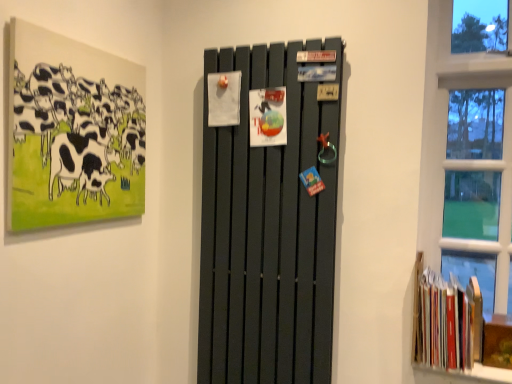
Question: From a real-world perspective, relative to matte black radiator at center, is hardcover books at lower right vertically above or below?

Choices:
 (A) below
 (B) above

Answer: (A)

Question: Is hardcover books at lower right taller or shorter than matte black radiator at center?

Choices:
 (A) short
 (B) tall

Answer: (A)

Question: Estimate the real-world distances between objects in this image. Which object is closer to the hardcover books at lower right?

Choices:
 (A) matte black radiator at center
 (B) matte black painting of cows at upper left

Answer: (A)

Question: Considering the real-world distances, which object is farthest from the hardcover books at lower right?

Choices:
 (A) matte black painting of cows at upper left
 (B) matte black radiator at center

Answer: (A)